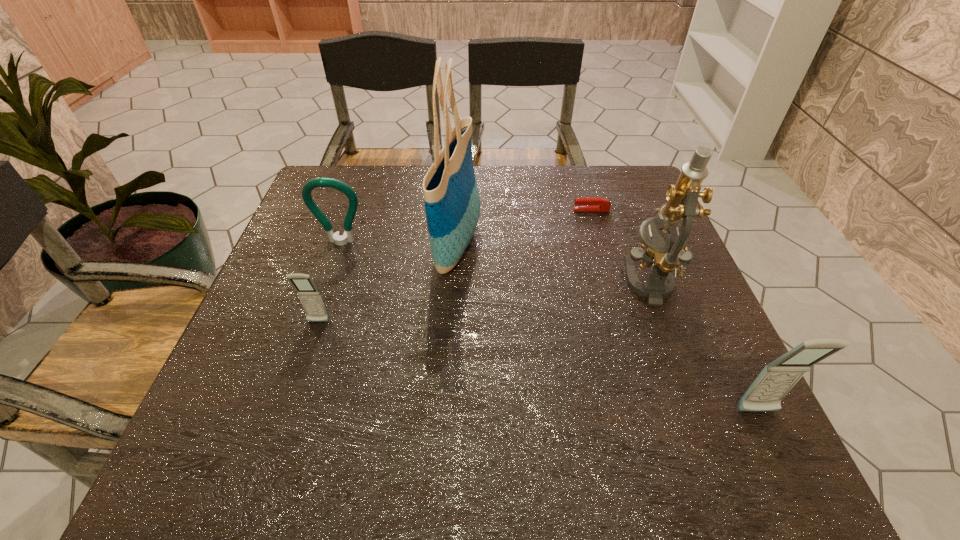
In the image, there is a desktop. Where is `vacant space at the near left corner`? The height and width of the screenshot is (540, 960). vacant space at the near left corner is located at coordinates (306, 379).

Where is `vacant point at the far right corner`? This screenshot has height=540, width=960. vacant point at the far right corner is located at coordinates (646, 213).

I want to click on vacant space that's between the microscope and the bottle opener, so click(x=497, y=263).

The image size is (960, 540). I want to click on empty space that is in between the second tallest object and the stapler, so click(622, 246).

Image resolution: width=960 pixels, height=540 pixels. Find the location of `vacant area that lies between the nearest object and the third object from left to right`. vacant area that lies between the nearest object and the third object from left to right is located at coordinates (608, 328).

You are a GUI agent. You are given a task and a screenshot of the screen. Output one action in this format:
    pyautogui.click(x=<x>, y=<y>)
    Task: Click on the free area in between the fourth object from right to left and the right cellular telephone
    Image resolution: width=960 pixels, height=540 pixels.
    Given the screenshot: What is the action you would take?
    pyautogui.click(x=608, y=328)

Where is `vacant area between the microscope and the tote bag`? The image size is (960, 540). vacant area between the microscope and the tote bag is located at coordinates (556, 263).

The image size is (960, 540). Find the location of `vacant space in between the bottle opener and the tote bag`. vacant space in between the bottle opener and the tote bag is located at coordinates (399, 243).

Locate an element on the screen. This screenshot has width=960, height=540. free space that is in between the microscope and the shortest object is located at coordinates (622, 246).

At what (x,y) coordinates should I click in order to perform the action: click on free spot between the bottle opener and the second shortest object. Please return your answer as a coordinate pair (x, y). The image size is (960, 540). Looking at the image, I should click on (330, 282).